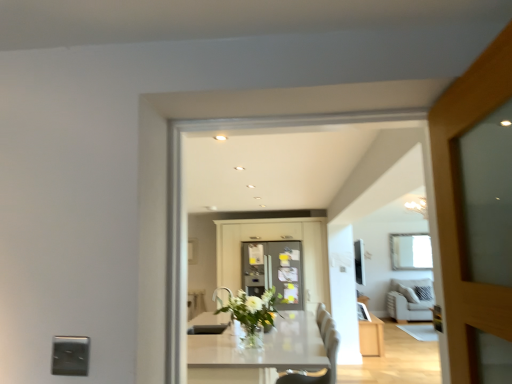
In order to click on white fabric couch at right in this screenshot , I will do `click(408, 301)`.

What do you see at coordinates (257, 352) in the screenshot? The width and height of the screenshot is (512, 384). I see `white glossy table at center` at bounding box center [257, 352].

This screenshot has height=384, width=512. Describe the element at coordinates (275, 240) in the screenshot. I see `matte gray refrigerator at center, the second cabinetry from the right` at that location.

The width and height of the screenshot is (512, 384). I want to click on white glass vase at center, so click(x=253, y=313).

Describe the element at coordinates (253, 313) in the screenshot. I see `white glass vase at center` at that location.

Where is `white fabric couch at right`? Image resolution: width=512 pixels, height=384 pixels. white fabric couch at right is located at coordinates (408, 301).

From a real-world perspective, does white glossy table at center stand above white fabric couch at right?

No, from a real-world perspective, white glossy table at center is not over white fabric couch at right

In terms of width, does white glossy table at center look wider or thinner when compared to white fabric couch at right?

Considering their sizes, white glossy table at center looks broader than white fabric couch at right.

In the image, there is a white glossy table at center. Where is `couch below it (from the image's perspective)`? Image resolution: width=512 pixels, height=384 pixels. couch below it (from the image's perspective) is located at coordinates (408, 301).

From the image's perspective, is white fabric couch at right located above white leather chair at center?

Incorrect, from the image's perspective, white fabric couch at right is lower than white leather chair at center.

In the scene shown: Is white fabric couch at right with white leather chair at center?

white fabric couch at right is not next to white leather chair at center, and they're not touching.

Which is behind, white fabric couch at right or white leather chair at center?

white fabric couch at right is further away from the camera.

Find the location of a particular element. This screenshot has width=512, height=384. chair on the left of white fabric couch at right is located at coordinates (327, 369).

Is the position of white leather chair at center more distant than that of matte gray refrigerator at center, the second cabinetry from the right?

No, it is not.

Considering the sizes of white leather chair at center and matte gray refrigerator at center, the first cabinetry positioned from the left, in the image, is white leather chair at center taller or shorter than matte gray refrigerator at center, the first cabinetry positioned from the left,?

Considering their sizes, white leather chair at center has less height than matte gray refrigerator at center, the first cabinetry positioned from the left.

Based on their positions, is white leather chair at center located to the left or right of matte gray refrigerator at center, the second cabinetry from the right?

From the image, it's evident that white leather chair at center is to the right of matte gray refrigerator at center, the second cabinetry from the right.

Can you tell me how much white leather chair at center and matte gray refrigerator at center, the second cabinetry from the right, differ in facing direction?

The facing directions of white leather chair at center and matte gray refrigerator at center, the second cabinetry from the right, are 90.3 degrees apart.

Can we say white fabric couch at right lies outside metallic refrigerator at center?

Absolutely, white fabric couch at right is external to metallic refrigerator at center.

Can you confirm if white fabric couch at right is thinner than metallic refrigerator at center?

Indeed, white fabric couch at right has a lesser width compared to metallic refrigerator at center.

Does white fabric couch at right have a larger size compared to metallic refrigerator at center?

No.

Is point (403, 289) behind point (264, 259)?

That is True.

From the picture: From their relative heights in the image, would you say white glossy table at center is taller or shorter than white glass vase at center?

In the image, white glossy table at center appears to be taller than white glass vase at center.

What's the angular difference between white glossy table at center and white glass vase at center's facing directions?

The angle between the facing direction of white glossy table at center and the facing direction of white glass vase at center is 2.71 degrees.

Can you confirm if white glossy table at center is bigger than white glass vase at center?

Yes, white glossy table at center is bigger than white glass vase at center.

From the image's perspective, relative to white glass vase at center, is white glossy table at center above or below?

Clearly, from the image's perspective, white glossy table at center is below white glass vase at center.

Is white glossy table at center not near metallic refrigerator at center?

Yes, white glossy table at center and metallic refrigerator at center are quite far apart.

Which of these two, white glossy table at center or metallic refrigerator at center, is wider?

white glossy table at center is wider.

Is white glossy table at center to the right of metallic refrigerator at center from the viewer's perspective?

Incorrect, white glossy table at center is not on the right side of metallic refrigerator at center.

Is white glossy table at center oriented towards metallic refrigerator at center?

No, white glossy table at center is not oriented towards metallic refrigerator at center.

From a real-world perspective, is matte gray refrigerator at center, the first cabinetry positioned from the left, on white glass vase at center?

Indeed, from a real-world perspective, matte gray refrigerator at center, the first cabinetry positioned from the left, stands above white glass vase at center.

Who is smaller, matte gray refrigerator at center, the second cabinetry from the right, or white glass vase at center?

With smaller size is white glass vase at center.

Which object is further away from the camera, matte gray refrigerator at center, the first cabinetry positioned from the left, or white glass vase at center?

matte gray refrigerator at center, the first cabinetry positioned from the left.

From the image's perspective, is matte gray refrigerator at center, the first cabinetry positioned from the left, beneath white glass vase at center?

Yes, from the image's perspective, matte gray refrigerator at center, the first cabinetry positioned from the left, is beneath white glass vase at center.

What are the coordinates of `table in front of the white fabric couch at right` in the screenshot? It's located at (257, 352).

Identify the location of couch on the right of white leather chair at center. This screenshot has width=512, height=384. (408, 301).

Based on their spatial positions, is matte gray refrigerator at center, the second cabinetry from the right, or white glass vase at center further from white leather chair at center?

matte gray refrigerator at center, the second cabinetry from the right, is further to white leather chair at center.

Which object lies nearer to the anchor point metallic refrigerator at center, matte gray refrigerator at center, the first cabinetry positioned from the left, or white glass vase at center?

matte gray refrigerator at center, the first cabinetry positioned from the left.

Looking at the image, which one is located closer to white fabric couch at right, white glossy table at center or matte white cabinet at lower right, the first cabinetry in the right-to-left sequence?

The object closer to white fabric couch at right is matte white cabinet at lower right, the first cabinetry in the right-to-left sequence.

When comparing their distances from matte gray refrigerator at center, the second cabinetry from the right, does white glossy table at center or matte white cabinet at lower right, which appears as the 2th cabinetry when viewed from the left, seem further?

white glossy table at center is further to matte gray refrigerator at center, the second cabinetry from the right.

When comparing their distances from white glossy table at center, does white leather chair at center or metallic refrigerator at center seem further?

Among the two, metallic refrigerator at center is located further to white glossy table at center.

Looking at the image, which one is located further to matte white cabinet at lower right, the first cabinetry in the right-to-left sequence, white glossy table at center or white glass vase at center?

white glossy table at center.

Based on their spatial positions, is white leather chair at center or white glass vase at center closer to white fabric couch at right?

Based on the image, white leather chair at center appears to be nearer to white fabric couch at right.

When comparing their distances from matte gray refrigerator at center, the first cabinetry positioned from the left, does white glossy table at center or white glass vase at center seem closer?

white glass vase at center lies closer to matte gray refrigerator at center, the first cabinetry positioned from the left, than the other object.

The width and height of the screenshot is (512, 384). In order to click on screen door positioned between white leather chair at center and matte gray refrigerator at center, the second cabinetry from the right, from near to far in this screenshot , I will do `click(274, 271)`.

Find the location of `chair between white glossy table at center and metallic refrigerator at center along the z-axis`. chair between white glossy table at center and metallic refrigerator at center along the z-axis is located at coordinates (327, 369).

Identify the location of plant between satin silver outlet at lower left and white fabric couch at right from front to back. This screenshot has width=512, height=384. (253, 313).

Identify the location of chair between satin silver outlet at lower left and matte white cabinet at lower right, the first cabinetry in the right-to-left sequence, from front to back. (327, 369).